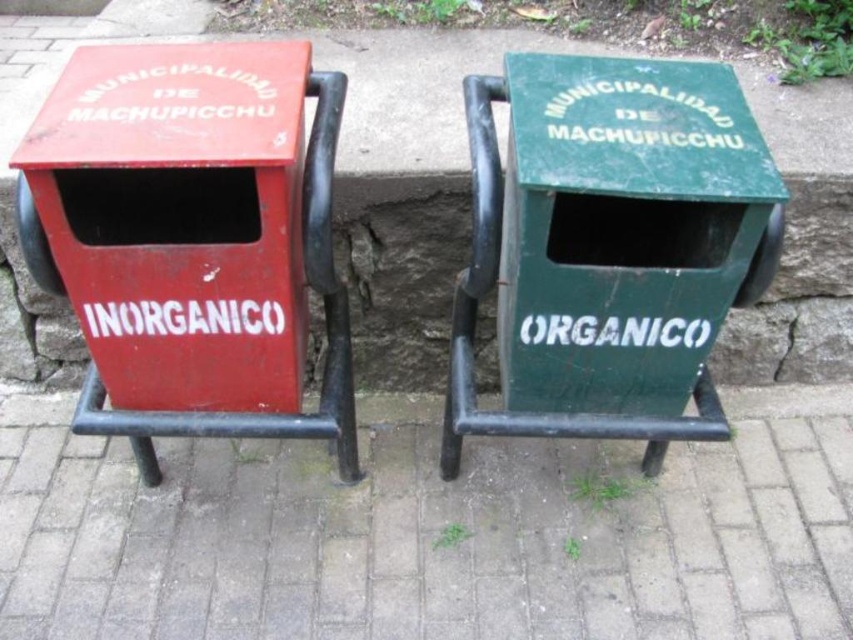
Question: Can you confirm if matte red bin at left is positioned above green matte trash bin at center?

Choices:
 (A) yes
 (B) no

Answer: (A)

Question: Does green matte trash bin at center lie behind metallic trash bin at center?

Choices:
 (A) no
 (B) yes

Answer: (A)

Question: Which of these objects is positioned closest to the matte red bin at left?

Choices:
 (A) green matte trash bin at center
 (B) gray concrete pavement at center

Answer: (A)

Question: Among these points, which one is farthest from the camera?

Choices:
 (A) (65, 140)
 (B) (643, 115)
 (C) (407, 609)
 (D) (407, 387)

Answer: (D)

Question: Among these objects, which one is farthest from the camera?

Choices:
 (A) matte red bin at left
 (B) green matte trash bin at center
 (C) metallic trash bin at center
 (D) gray concrete pavement at center

Answer: (C)

Question: In this image, where is green matte trash bin at center located relative to metallic trash bin at center?

Choices:
 (A) right
 (B) left

Answer: (A)